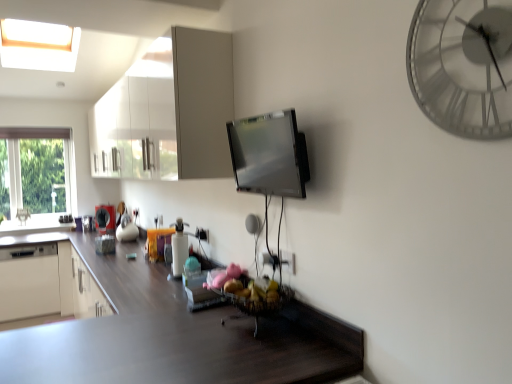
Question: Is dark wood countertop at lower center far from metallic silver clock at upper right?

Choices:
 (A) yes
 (B) no

Answer: (A)

Question: From the image's perspective, is dark wood countertop at lower center located above metallic silver clock at upper right?

Choices:
 (A) no
 (B) yes

Answer: (A)

Question: Can you confirm if dark wood countertop at lower center is bigger than metallic silver clock at upper right?

Choices:
 (A) no
 (B) yes

Answer: (B)

Question: Considering the relative sizes of dark wood countertop at lower center and metallic silver clock at upper right in the image provided, is dark wood countertop at lower center thinner than metallic silver clock at upper right?

Choices:
 (A) no
 (B) yes

Answer: (A)

Question: Is dark wood countertop at lower center at the left side of metallic silver clock at upper right?

Choices:
 (A) no
 (B) yes

Answer: (B)

Question: Is dark wood countertop at lower center at the right side of metallic silver clock at upper right?

Choices:
 (A) yes
 (B) no

Answer: (B)

Question: Is the surface of white glossy dishwasher at lower left, the first appliance positioned from the left, in direct contact with metallic silver clock at upper right?

Choices:
 (A) yes
 (B) no

Answer: (B)

Question: Are white glossy dishwasher at lower left, the first appliance positioned from the left, and metallic silver clock at upper right far apart?

Choices:
 (A) no
 (B) yes

Answer: (B)

Question: From the image's perspective, is white glossy dishwasher at lower left, acting as the 1th appliance starting from the bottom, under metallic silver clock at upper right?

Choices:
 (A) no
 (B) yes

Answer: (B)

Question: Does white glossy dishwasher at lower left, which appears as the 4th appliance when viewed from the top, have a lesser width compared to metallic silver clock at upper right?

Choices:
 (A) yes
 (B) no

Answer: (B)

Question: Is white glossy dishwasher at lower left, the first appliance positioned from the left, bigger than metallic silver clock at upper right?

Choices:
 (A) no
 (B) yes

Answer: (B)

Question: Can you confirm if white glossy dishwasher at lower left, positioned as the 2th appliance in back-to-front order, is shorter than metallic silver clock at upper right?

Choices:
 (A) yes
 (B) no

Answer: (B)

Question: Can you confirm if white glossy bottle at center, which appears as the 3th appliance when viewed from the top, is thinner than white glossy cabinet at upper center?

Choices:
 (A) yes
 (B) no

Answer: (A)